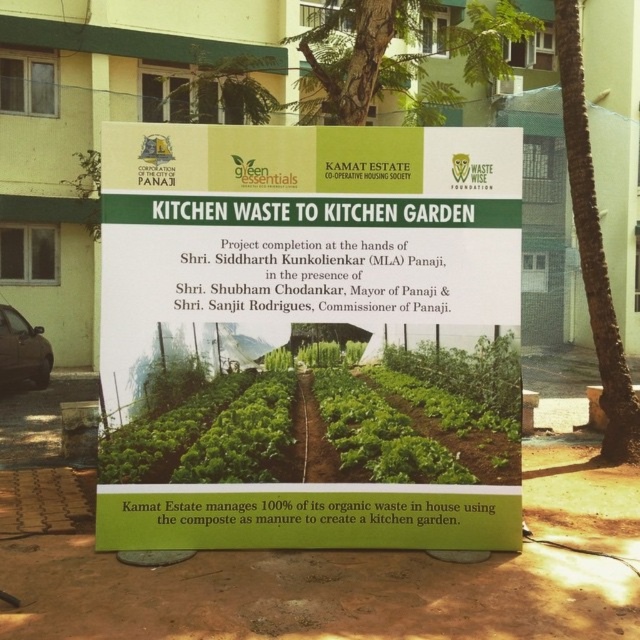
Which is behind, point (214, 428) or point (588, 234)?

Positioned behind is point (588, 234).

Looking at this image, is green leafy vegetables at center to the left of green bark tree at center from the viewer's perspective?

Indeed, green leafy vegetables at center is positioned on the left side of green bark tree at center.

What do you see at coordinates (424, 416) in the screenshot? The height and width of the screenshot is (640, 640). I see `green leafy vegetables at center` at bounding box center [424, 416].

Locate an element on the screen. This screenshot has width=640, height=640. green leafy vegetables at center is located at coordinates (424, 416).

Is point (432, 406) behind point (435, 116)?

No, (432, 406) is closer to viewer.

Which of these two, green leafy vegetables at center or green leafy tree at upper center, stands taller?

Standing taller between the two is green leafy tree at upper center.

Identify the location of green leafy vegetables at center. (424, 416).

This screenshot has width=640, height=640. In order to click on green leafy vegetables at center in this screenshot , I will do `click(424, 416)`.

Which is below, green leafy tree at upper center or green bark tree at center?

green bark tree at center is lower down.

Does green leafy tree at upper center appear over green bark tree at center?

Correct, green leafy tree at upper center is located above green bark tree at center.

The image size is (640, 640). Describe the element at coordinates (356, 56) in the screenshot. I see `green leafy tree at upper center` at that location.

Identify the location of green leafy tree at upper center. This screenshot has height=640, width=640. (356, 56).